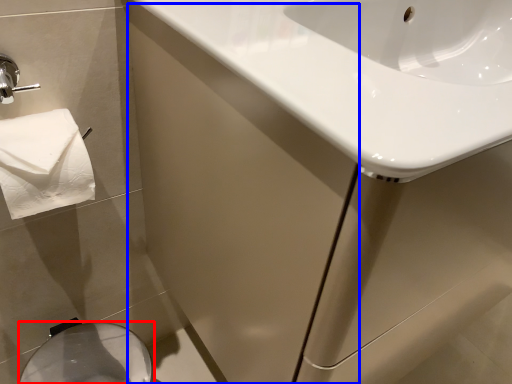
Question: Among these objects, which one is farthest to the camera, bidet (highlighted by a red box) or screen door (highlighted by a blue box)?

Choices:
 (A) bidet
 (B) screen door

Answer: (A)